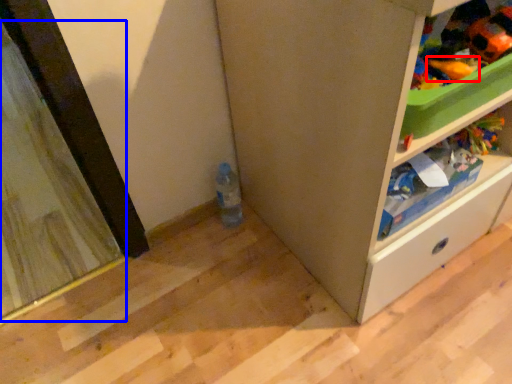
Question: Which object appears farthest to the camera in this image, toy (highlighted by a red box) or screen door (highlighted by a blue box)?

Choices:
 (A) toy
 (B) screen door

Answer: (B)